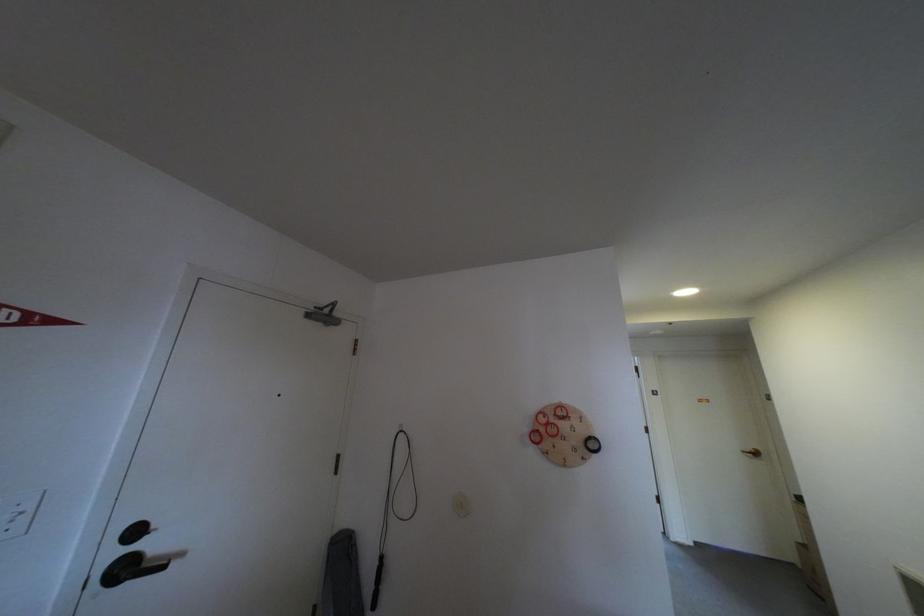
Locate an element on the screen. jump rope handle is located at coordinates (393, 507).